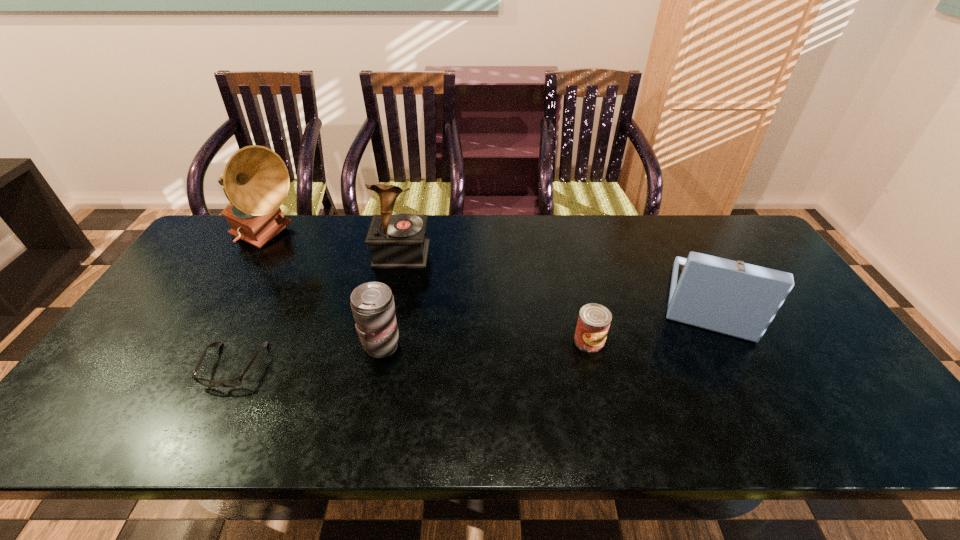
Where is `vacant space situated on the horn of the tallest phonograph record`? The width and height of the screenshot is (960, 540). vacant space situated on the horn of the tallest phonograph record is located at coordinates (407, 239).

The width and height of the screenshot is (960, 540). I want to click on free region located at the horn opening of the fifth shortest object, so click(393, 296).

The width and height of the screenshot is (960, 540). Identify the location of vacant space located 0.300m on the left of the shortest phonograph record. (553, 301).

I want to click on free spot located on the side of the third shortest object where the control switches are located, so click(x=437, y=346).

Locate an element on the screen. The image size is (960, 540). vacant area located 0.280m on the right of the second object from right to left is located at coordinates (712, 340).

Identify the location of free space located on the front-facing side of the spectacles. (207, 418).

Find the location of a particular element. This screenshot has width=960, height=540. object located in the left edge section of the desktop is located at coordinates (256, 181).

Identify the location of object that is at the right edge. Image resolution: width=960 pixels, height=540 pixels. (734, 298).

I want to click on object located at the far left corner, so click(x=256, y=181).

Where is `vacant area at the far edge of the desktop`? The image size is (960, 540). vacant area at the far edge of the desktop is located at coordinates (629, 235).